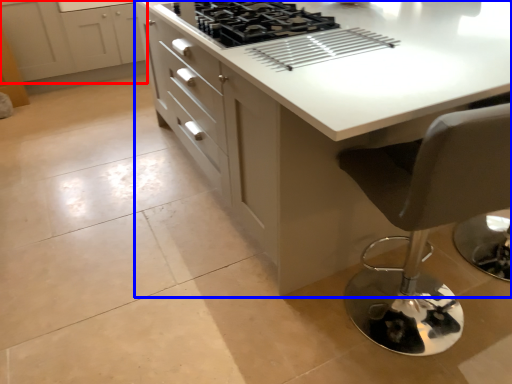
Question: Among these objects, which one is nearest to the camera, cabinetry (highlighted by a red box) or countertop (highlighted by a blue box)?

Choices:
 (A) cabinetry
 (B) countertop

Answer: (B)